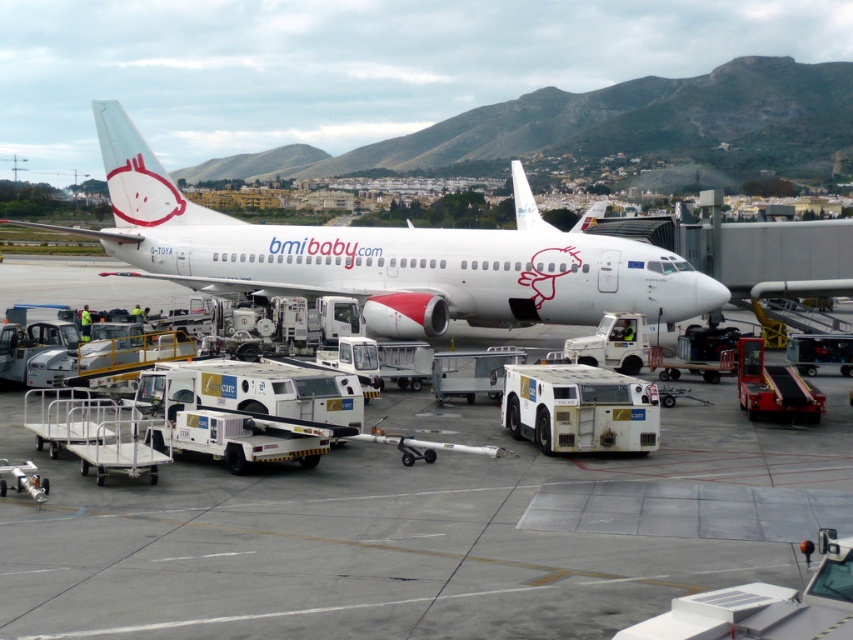
Find the location of a particular element. white rubber tarmac at center is located at coordinates (424, 531).

Is point (816, 490) positioned after point (537, 264)?

No, (816, 490) is closer to viewer.

Find the location of a particular element. Image resolution: width=853 pixels, height=640 pixels. white rubber tarmac at center is located at coordinates click(x=424, y=531).